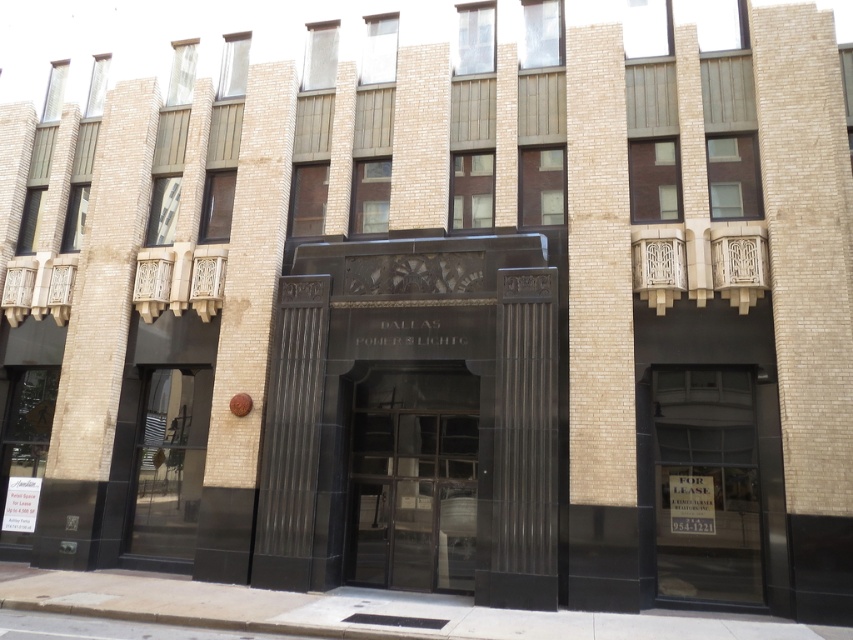
Is black polished stone entrance at center bigger than transparent glass door at center?

Incorrect, black polished stone entrance at center is not larger than transparent glass door at center.

Can you confirm if black polished stone entrance at center is positioned to the right of transparent glass door at center?

Incorrect, black polished stone entrance at center is not on the right side of transparent glass door at center.

This screenshot has height=640, width=853. Describe the element at coordinates (416, 360) in the screenshot. I see `black polished stone entrance at center` at that location.

At what (x,y) coordinates should I click in order to perform the action: click on black polished stone entrance at center. Please return your answer as a coordinate pair (x, y). The height and width of the screenshot is (640, 853). Looking at the image, I should click on (416, 360).

Does clear glass door at center have a lesser width compared to transparent glass door at center?

A: Incorrect, clear glass door at center's width is not less than transparent glass door at center's.

From the picture: How distant is clear glass door at center from transparent glass door at center?

They are 11.47 feet apart.

Does point (386, 433) come closer to viewer compared to point (697, 380)?

No, it is behind (697, 380).

You are a GUI agent. You are given a task and a screenshot of the screen. Output one action in this format:
    pyautogui.click(x=<x>, y=<y>)
    Task: Click on the clear glass door at center
    
    Given the screenshot: What is the action you would take?
    pyautogui.click(x=415, y=480)

Does black polished stone entrance at center have a greater width compared to clear glass door at center?

No.

Which is below, black polished stone entrance at center or clear glass door at center?

black polished stone entrance at center is lower down.

Locate an element on the screen. black polished stone entrance at center is located at coordinates (416, 360).